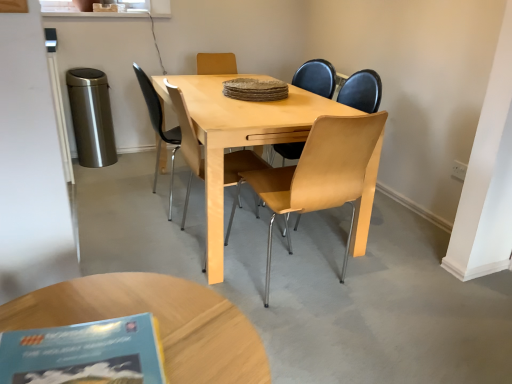
Question: From the image's perspective, is light brown wooden coffee table at lower center positioned above or below blue paper book at lower left?

Choices:
 (A) above
 (B) below

Answer: (B)

Question: From their relative heights in the image, would you say light brown wooden coffee table at lower center is taller or shorter than blue paper book at lower left?

Choices:
 (A) tall
 (B) short

Answer: (A)

Question: Considering the real-world distances, which object is farthest from the light wood/metallic chair at center, marked as the second chair in a left-to-right arrangement?

Choices:
 (A) light brown wooden coffee table at lower center
 (B) blue paper book at lower left
 (C) light brown wood chair at center, which is counted as the 2th chair, starting from the right

Answer: (B)

Question: Estimate the real-world distances between objects in this image. Which object is closer to the light brown wood chair at center, positioned as the 1th chair in left-to-right order?

Choices:
 (A) blue paper book at lower left
 (B) light wood/metallic chair at center, marked as the second chair in a left-to-right arrangement
 (C) light brown wooden coffee table at lower center

Answer: (B)